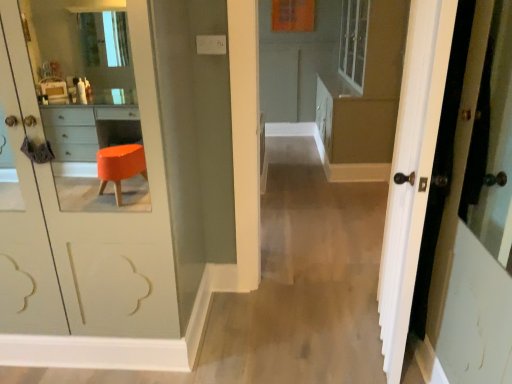
Question: Considering the positions of white wood door at right and matte brown dresser at center in the image, is white wood door at right taller or shorter than matte brown dresser at center?

Choices:
 (A) tall
 (B) short

Answer: (B)

Question: From the image's perspective, is white wood door at right positioned above or below matte brown dresser at center?

Choices:
 (A) above
 (B) below

Answer: (B)

Question: In terms of width, does white wood door at right look wider or thinner when compared to matte brown dresser at center?

Choices:
 (A) thin
 (B) wide

Answer: (A)

Question: Looking at their shapes, would you say matte brown dresser at center is wider or thinner than white wood door at right?

Choices:
 (A) wide
 (B) thin

Answer: (A)

Question: Considering the relative positions of matte brown dresser at center and white wood door at right in the image provided, is matte brown dresser at center to the left or to the right of white wood door at right?

Choices:
 (A) right
 (B) left

Answer: (A)

Question: Is matte brown dresser at center in front of or behind white wood door at right in the image?

Choices:
 (A) front
 (B) behind

Answer: (B)

Question: Is matte brown dresser at center spatially inside white wood door at right, or outside of it?

Choices:
 (A) inside
 (B) outside

Answer: (B)